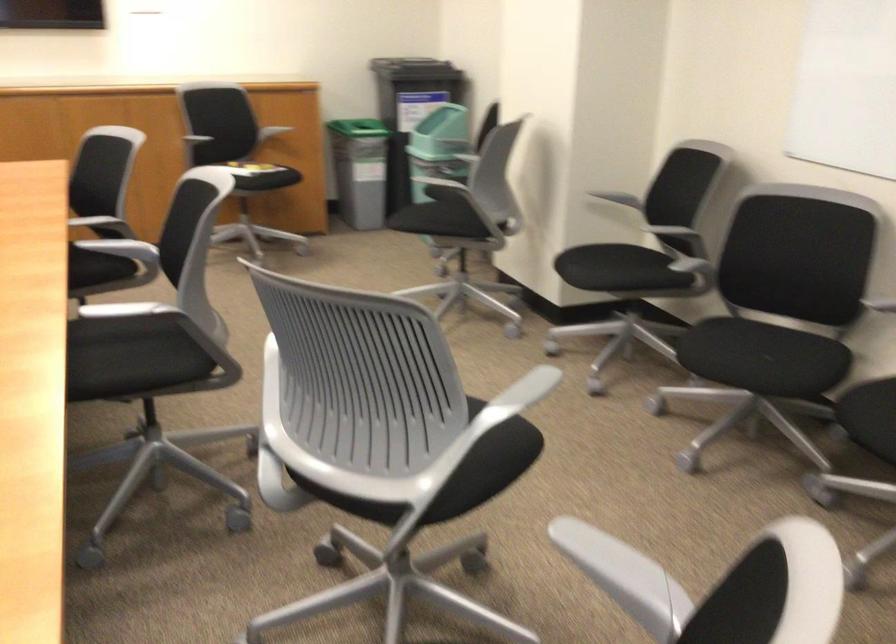
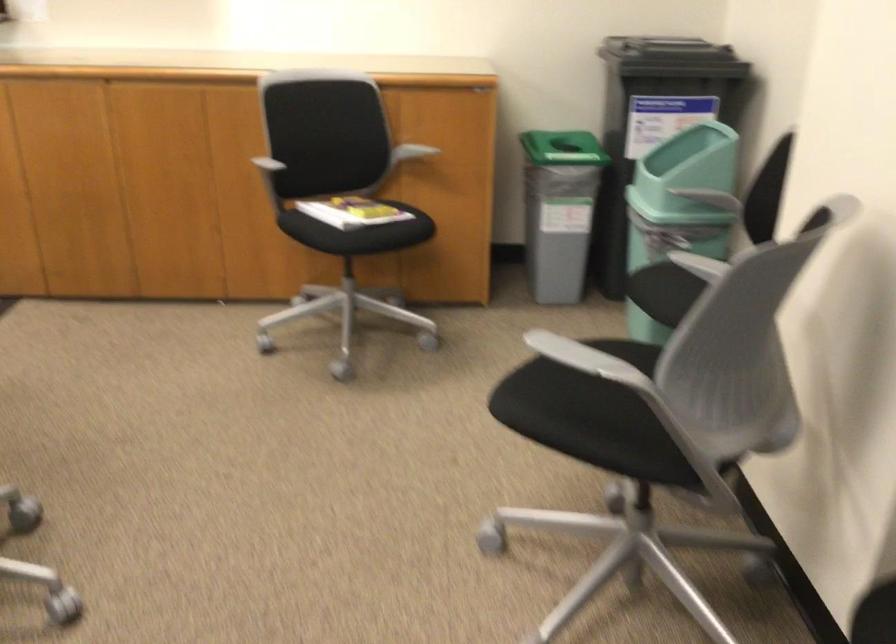
Question: The images are taken continuously from a first-person perspective. In which direction are you moving?

Choices:
 (A) Left
 (B) Right
 (C) Forward
 (D) Backward

Answer: (C)